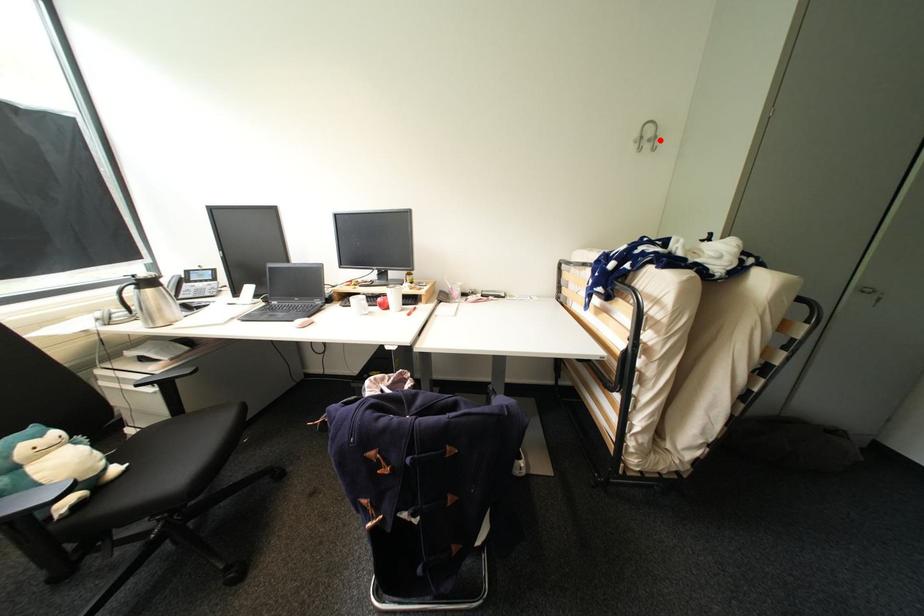
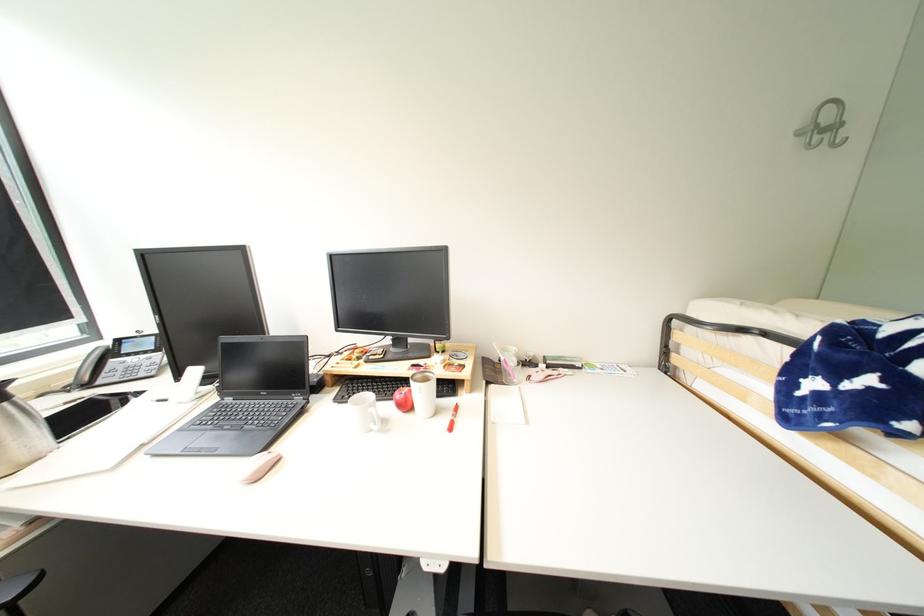
Locate, in the second image, the point that corresponds to the highlighted location in the first image.

(841, 128)